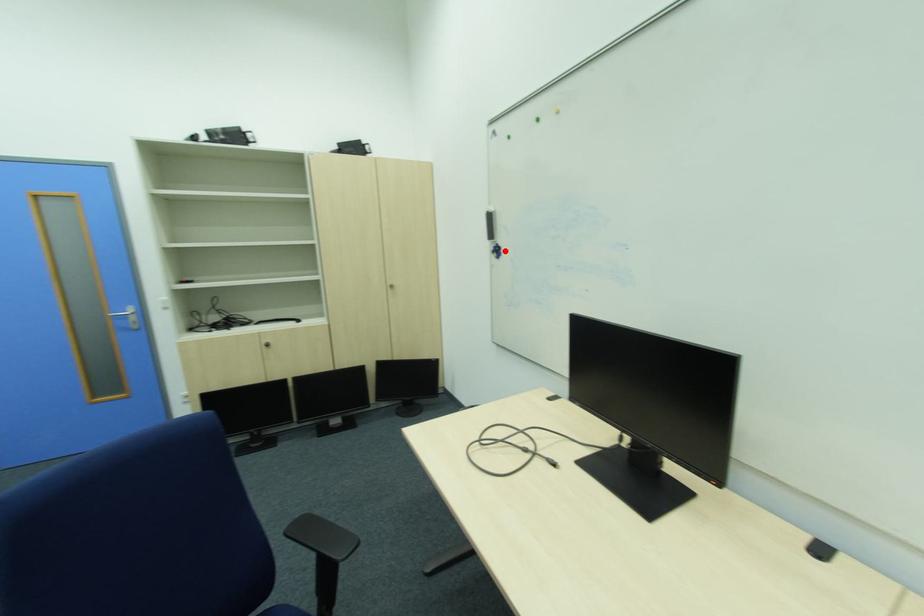
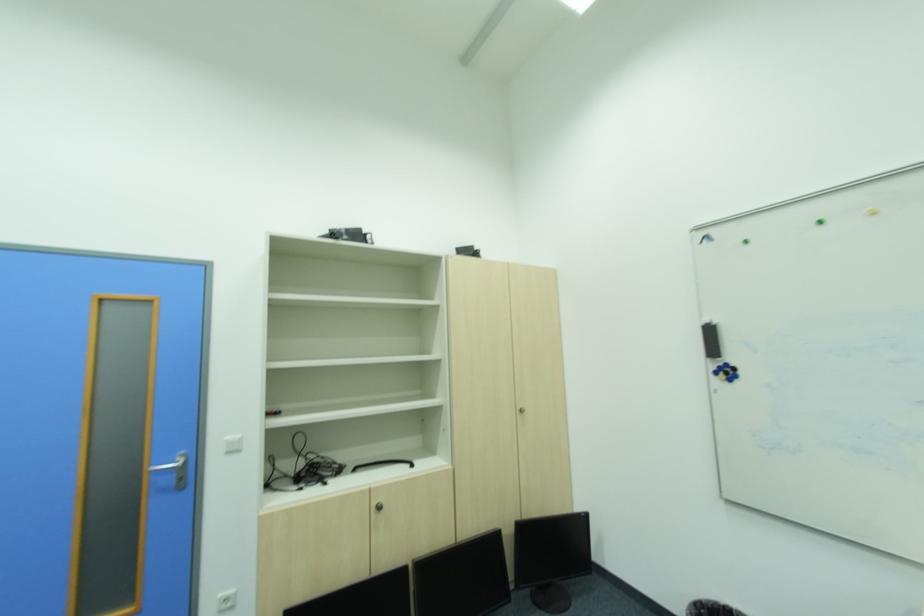
Find the pixel in the second image that matches the highlighted location in the first image.

(736, 371)